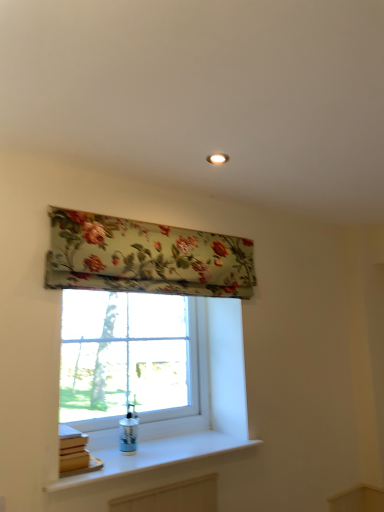
Find the location of a particular element. free space in front of clear glass window at center is located at coordinates (142, 457).